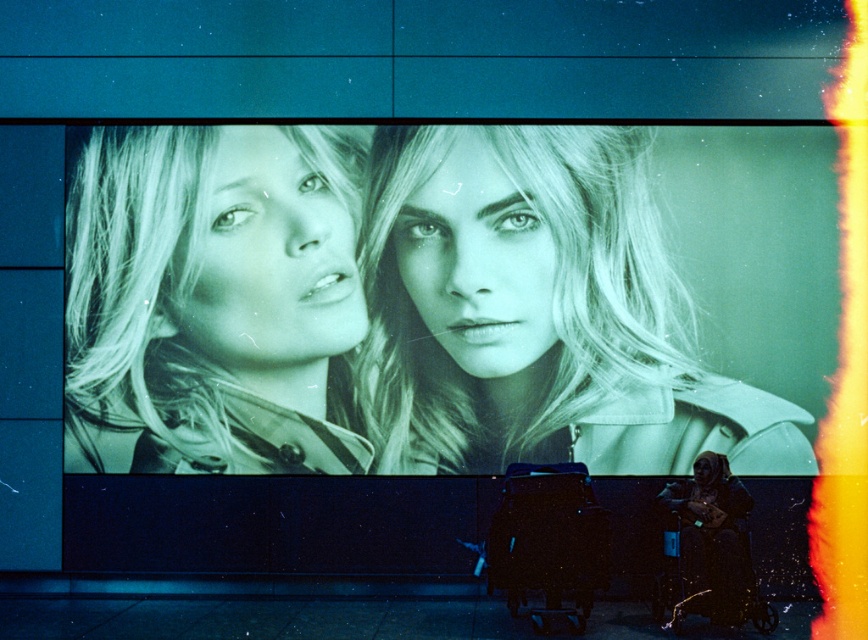
Is matte beige trench coat at center shorter than monochrome fabric at left?

Indeed, matte beige trench coat at center has a lesser height compared to monochrome fabric at left.

Which of these two, matte beige trench coat at center or monochrome fabric at left, stands shorter?

matte beige trench coat at center is shorter.

Does point (720, 400) come in front of point (248, 289)?

Yes.

Identify the location of matte beige trench coat at center. This screenshot has height=640, width=868. (540, 314).